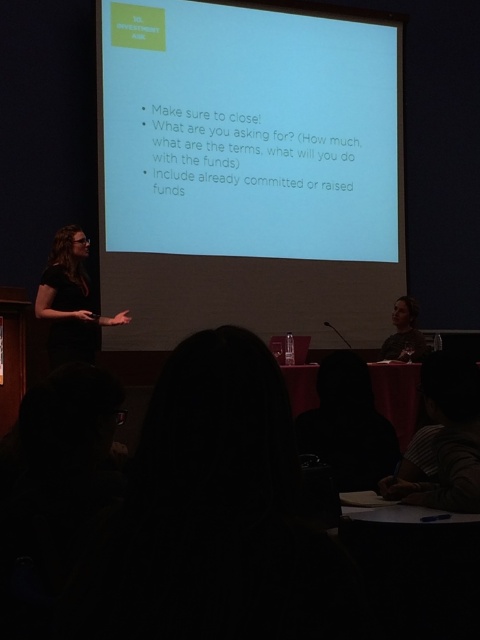
Question: Considering the relative positions of white matte projection screen at center and black matte shirt at left in the image provided, where is white matte projection screen at center located with respect to black matte shirt at left?

Choices:
 (A) right
 (B) left

Answer: (A)

Question: Among these objects, which one is farthest from the camera?

Choices:
 (A) white matte projection screen at center
 (B) black matte shirt at left

Answer: (A)

Question: Can you confirm if white matte projection screen at center is wider than black matte shirt at left?

Choices:
 (A) yes
 (B) no

Answer: (A)

Question: Which point is closer to the camera?

Choices:
 (A) white matte projection screen at center
 (B) black matte shirt at left

Answer: (B)

Question: Does white matte projection screen at center have a smaller size compared to black matte shirt at left?

Choices:
 (A) yes
 (B) no

Answer: (B)